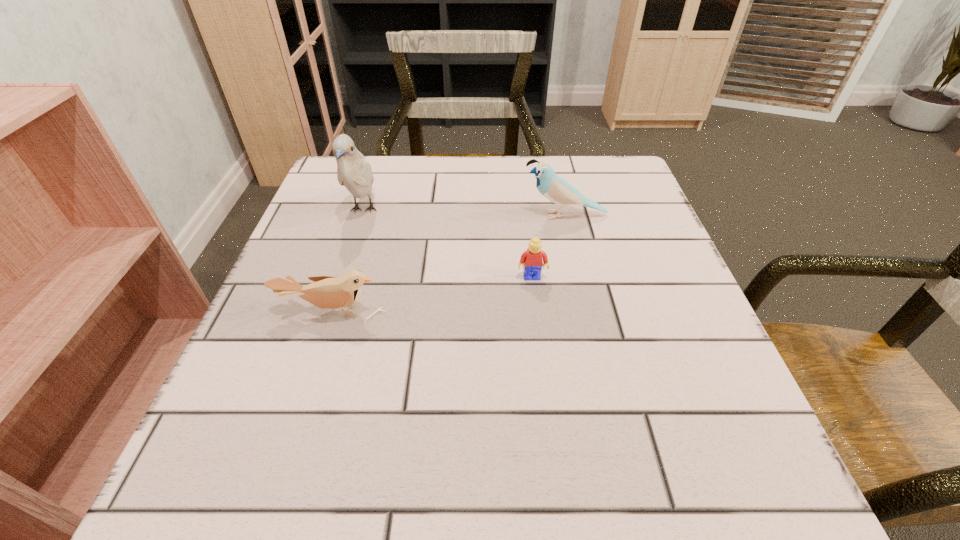
Where is `vacant space at the far right corner`? The image size is (960, 540). vacant space at the far right corner is located at coordinates (604, 158).

Find the location of a particular element. This screenshot has width=960, height=540. free space at the near right corner is located at coordinates (648, 460).

I want to click on vacant space that's between the nearest bird and the tallest object, so click(x=348, y=261).

I want to click on free area in between the tallest bird and the rightmost bird, so click(464, 213).

Image resolution: width=960 pixels, height=540 pixels. Identify the location of vacant point located between the second shortest bird and the tallest bird. (464, 213).

The image size is (960, 540). Identify the location of empty space that is in between the Lego and the tallest object. (447, 244).

The height and width of the screenshot is (540, 960). What are the coordinates of `vacant space that is in between the tallest bird and the second nearest object` in the screenshot? It's located at (447, 244).

At what (x,y) coordinates should I click in order to perform the action: click on vacant space that's between the tallest bird and the rightmost bird. Please return your answer as a coordinate pair (x, y). Looking at the image, I should click on (464, 213).

The image size is (960, 540). I want to click on vacant space in between the shortest bird and the tallest bird, so click(x=348, y=261).

At what (x,y) coordinates should I click in order to perform the action: click on free space that is in between the second nearest object and the nearest object. Please return your answer as a coordinate pair (x, y). The image size is (960, 540). Looking at the image, I should click on (432, 294).